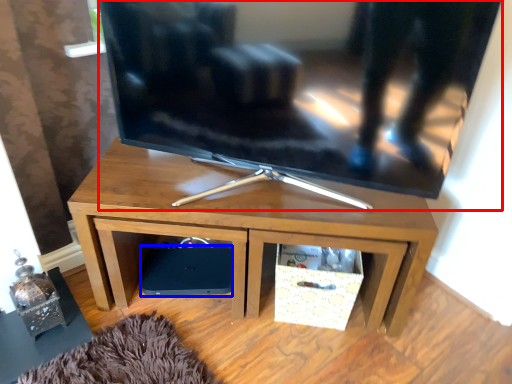
Question: Which object appears closest to the camera in this image, television (highlighted by a red box) or speaker (highlighted by a blue box)?

Choices:
 (A) television
 (B) speaker

Answer: (A)